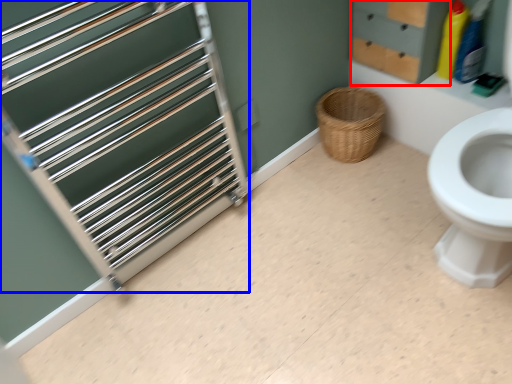
Question: Which point is closer to the camera, drawer (highlighted by a red box) or cage (highlighted by a blue box)?

Choices:
 (A) drawer
 (B) cage

Answer: (B)